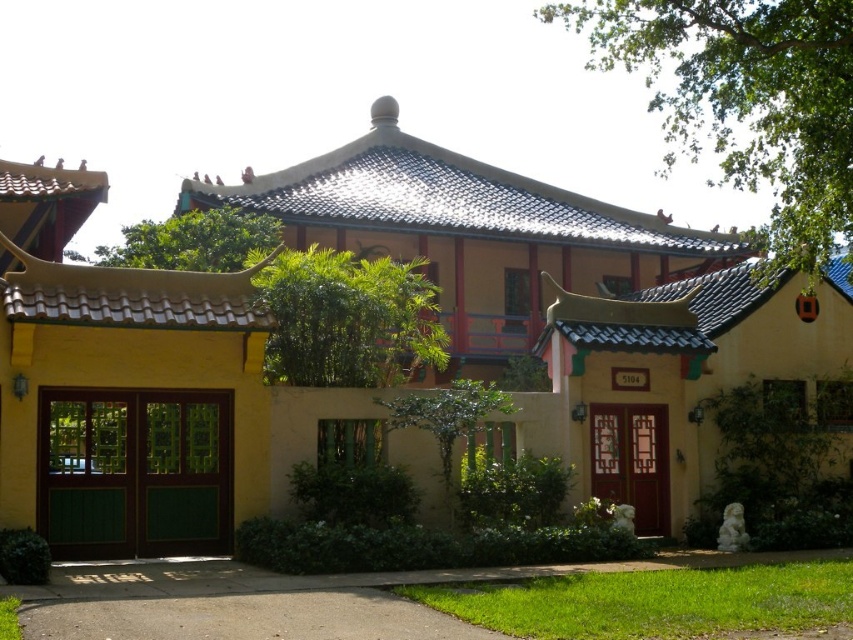
You are standing in front of the traditional East Asian building with a curved roof. There is a point marked at coordinates (746, 100) on the image. What object is located at that point?

The point marked at coordinates (746, 100) indicates the location of a green leafy tree at upper right.